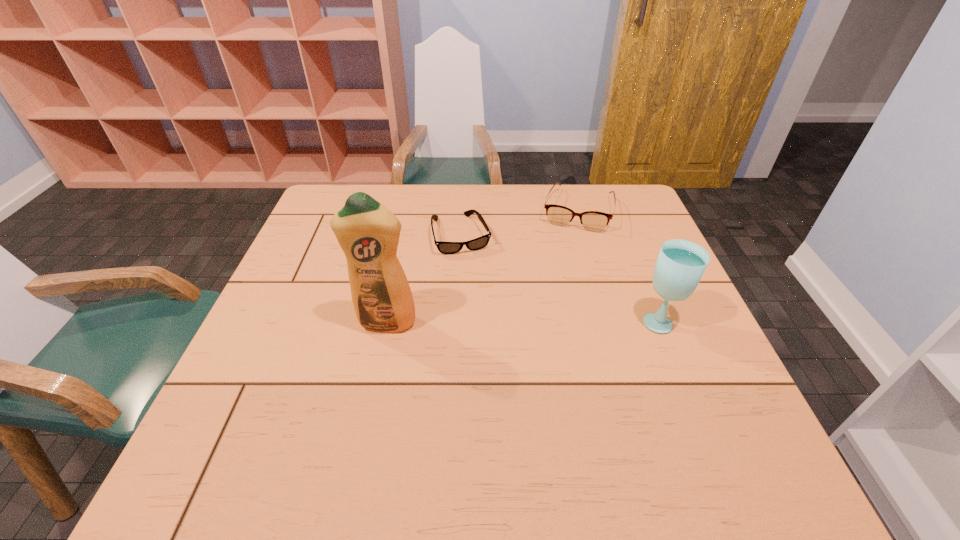
This screenshot has width=960, height=540. Find the location of `free space between the spectacles and the tallest object`. free space between the spectacles and the tallest object is located at coordinates (482, 267).

At what (x,y) coordinates should I click in order to perform the action: click on vacant region between the spectacles and the glass. Please return your answer as a coordinate pair (x, y). This screenshot has height=540, width=960. Looking at the image, I should click on (618, 266).

At what (x,y) coordinates should I click in order to perform the action: click on free space between the third shortest object and the spectacles. Please return your answer as a coordinate pair (x, y). Looking at the image, I should click on (618, 266).

Identify the location of unoccupied position between the second shortest object and the tallest object. (482, 267).

Locate an element on the screen. This screenshot has width=960, height=540. free space between the third tallest object and the third shortest object is located at coordinates (618, 266).

You are a GUI agent. You are given a task and a screenshot of the screen. Output one action in this format:
    pyautogui.click(x=<x>, y=<y>)
    Task: Click on the object that is the third closest to the shortest object
    
    Given the screenshot: What is the action you would take?
    pyautogui.click(x=680, y=265)

Select which object is the second closest to the shortest object. Please provide its 2D coordinates. Your answer should be formatted as a tuple, i.e. [(x, y)], where the tuple contains the x and y coordinates of a point satisfying the conditions above.

[(368, 233)]

Find the location of a particular element. The height and width of the screenshot is (540, 960). free space in the image that satisfies the following two spatial constraints: 1. on the front side of the third shortest object; 2. on the left side of the second object from left to right is located at coordinates pyautogui.click(x=457, y=320).

Image resolution: width=960 pixels, height=540 pixels. Identify the location of free location that satisfies the following two spatial constraints: 1. on the back side of the spectacles; 2. on the right side of the sunglasses. (463, 211).

Find the location of a particular element. vacant space that satisfies the following two spatial constraints: 1. on the front side of the spectacles; 2. on the right side of the glass is located at coordinates (610, 320).